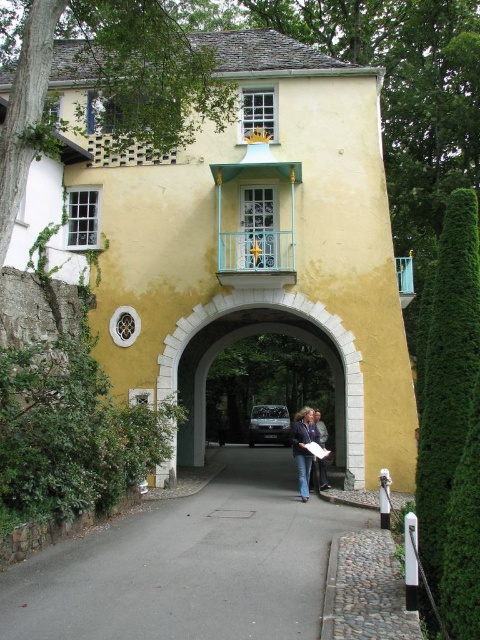
Is green leafy hedge at right shorter than white stone archway at center?

Yes, green leafy hedge at right is shorter than white stone archway at center.

Does point (437, 406) come in front of point (360, 481)?

Yes, point (437, 406) is in front of point (360, 481).

Where is `green leafy hedge at right`? The height and width of the screenshot is (640, 480). green leafy hedge at right is located at coordinates (448, 396).

The height and width of the screenshot is (640, 480). I want to click on green leafy hedge at right, so click(x=448, y=396).

At what (x,y) coordinates should I click in order to perform the action: click on dark blue jeans at center. Please return your answer as a coordinate pair (x, y). This screenshot has height=640, width=480. Looking at the image, I should click on (304, 448).

Is point (305, 470) less distant than point (312, 465)?

That is True.

Locate an element on the screen. The height and width of the screenshot is (640, 480). dark blue jeans at center is located at coordinates (304, 448).

Does point (468, 552) lie in front of point (326, 476)?

That is True.

Can you confirm if green leafy hedge at right is thinner than light brown leather jacket at center?

No.

Identify the location of green leafy hedge at right. This screenshot has height=640, width=480. (448, 396).

You are a GUI agent. You are given a task and a screenshot of the screen. Output one action in this format:
    pyautogui.click(x=<x>, y=<y>)
    Task: Click on the green leafy hedge at right
    Image resolution: width=480 pixels, height=640 pixels.
    Given the screenshot: What is the action you would take?
    pyautogui.click(x=448, y=396)